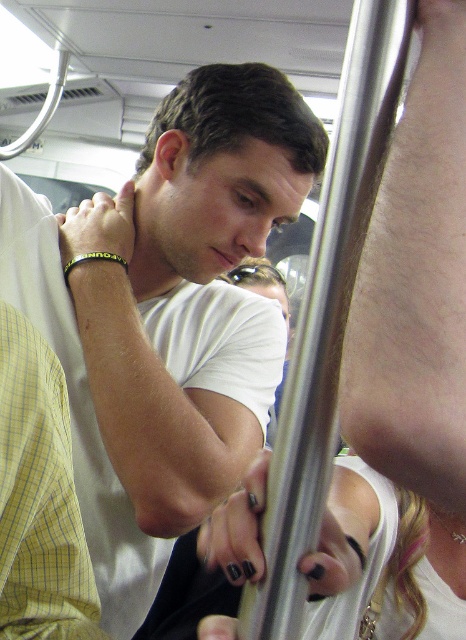
Question: Among these objects, which one is farthest from the camera?

Choices:
 (A) black rubber bracelet at upper left
 (B) white matte t-shirt at center

Answer: (A)

Question: Which object is closer to the camera taking this photo?

Choices:
 (A) black rubber bracelet at upper left
 (B) white matte t-shirt at center

Answer: (B)

Question: Does white matte t-shirt at center appear under black rubber bracelet at upper left?

Choices:
 (A) no
 (B) yes

Answer: (B)

Question: Does white matte t-shirt at center have a greater width compared to black rubber bracelet at upper left?

Choices:
 (A) no
 (B) yes

Answer: (B)

Question: Can you confirm if white matte t-shirt at center is positioned above black rubber bracelet at upper left?

Choices:
 (A) yes
 (B) no

Answer: (B)